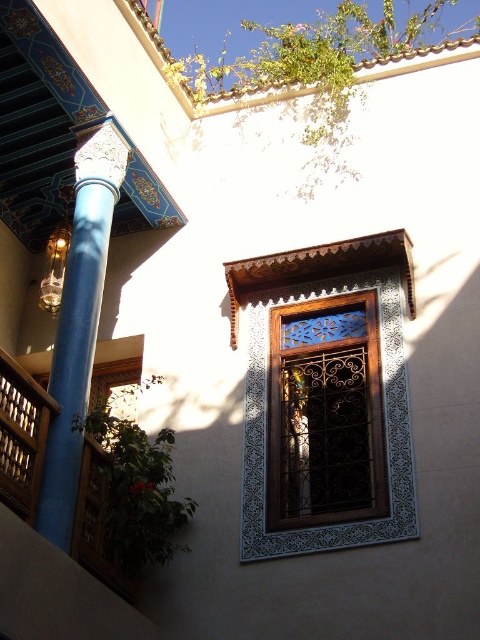
Based on the photo, you are standing in the courtyard and want to locate the wooden lattice window at center. According to the coordinates provided, where exactly is it positioned in the image?

The wooden lattice window at center is located at the coordinates point (324, 413).

You are an interior designer planning to place a decorative item between the wooden lattice window at center and the blue glossy column at left. Considering their widths, which object should you place the item closer to to ensure it fits better?

The wooden lattice window at center is wider than the blue glossy column at left. Therefore, placing the decorative item closer to the wooden lattice window at center would ensure better fit due to its greater width.

You are a painter standing at the wooden lattice window at center, and you want to paint the blue glossy column at left. If your ladder can extend up to 40 feet, can you reach the column from your current position?

The distance between the wooden lattice window at center and the blue glossy column at left is 39.95 feet, which is just under the ladder extension limit of 40 feet. Therefore, the painter can reach the column from the current position.